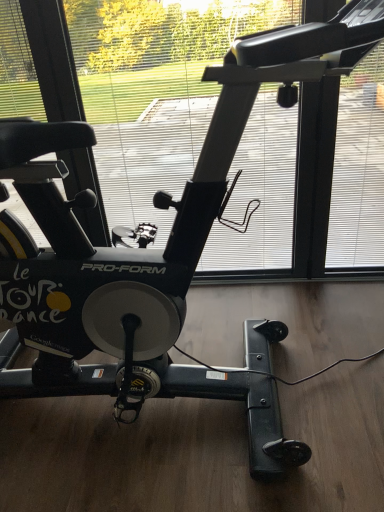
What do you see at coordinates (154, 90) in the screenshot? I see `transparent glass window at center` at bounding box center [154, 90].

At what (x,y) coordinates should I click in order to perform the action: click on transparent glass window at center. Please return your answer as a coordinate pair (x, y). The height and width of the screenshot is (512, 384). Looking at the image, I should click on (154, 90).

Image resolution: width=384 pixels, height=512 pixels. Identify the location of transparent glass window at center. (154, 90).